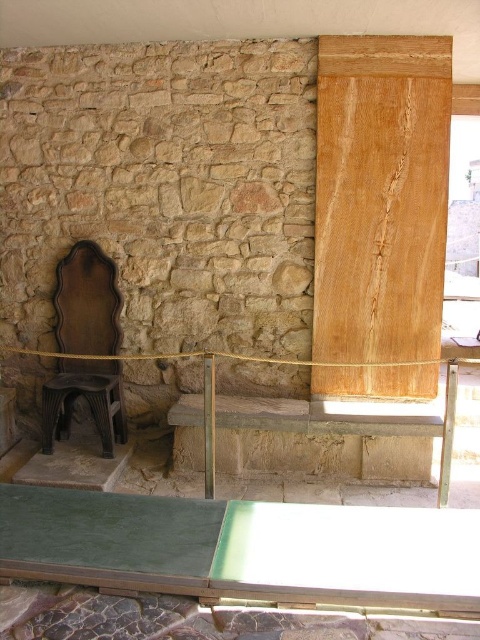
Which is in front, point (453, 582) or point (93, 337)?

Point (453, 582) is more forward.

Does green glass table at lower center have a lesser width compared to dark brown wood chair at left?

No, green glass table at lower center is not thinner than dark brown wood chair at left.

Where is `green glass table at lower center`? The height and width of the screenshot is (640, 480). green glass table at lower center is located at coordinates (242, 548).

Can you confirm if dark brown wood chair at left is positioned to the right of black plastic stool at lower left?

Indeed, dark brown wood chair at left is positioned on the right side of black plastic stool at lower left.

I want to click on dark brown wood chair at left, so click(x=86, y=301).

Can you confirm if green glass table at lower center is positioned above black plastic stool at lower left?

No, green glass table at lower center is not above black plastic stool at lower left.

Can you confirm if green glass table at lower center is bigger than black plastic stool at lower left?

Yes.

Who is more forward, (310,554) or (108,392)?

Point (310,554) is in front.

Identify the location of green glass table at lower center. (242, 548).